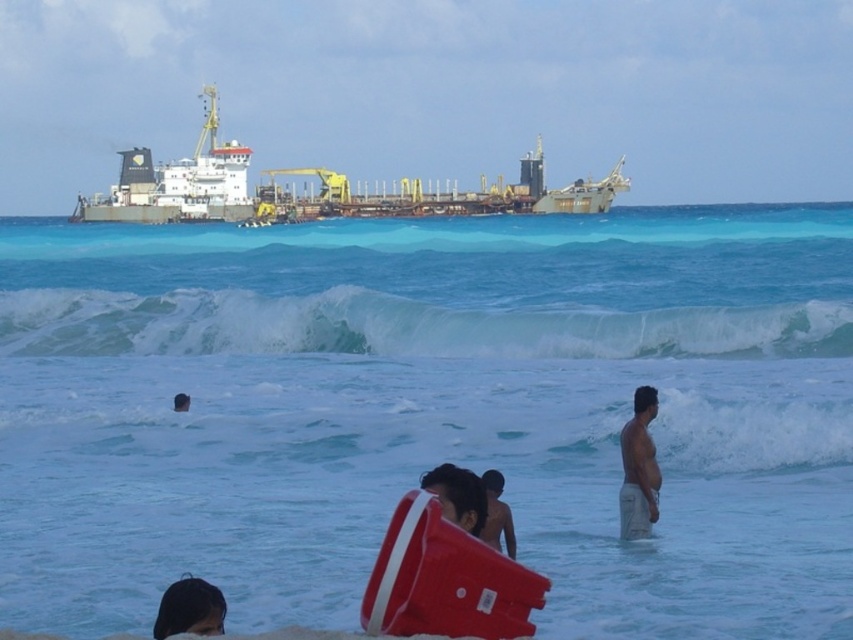
Question: Among these objects, which one is farthest from the camera?

Choices:
 (A) smooth skin person at center
 (B) dark brown hair at lower left
 (C) white frothy wave at upper center

Answer: (C)

Question: Estimate the real-world distances between objects in this image. Which object is farther from the white frothy wave at upper center?

Choices:
 (A) smooth skin person at center
 (B) dark brown hair at center
 (C) blue water at center
 (D) dark brown hair at lower left

Answer: (B)

Question: Does white frothy wave at upper center come in front of dark brown hair at lower left?

Choices:
 (A) no
 (B) yes

Answer: (A)

Question: In this image, where is white frothy wave at upper center located relative to skinny tan man at right?

Choices:
 (A) above
 (B) below

Answer: (A)

Question: Which of the following is the farthest from the observer?

Choices:
 (A) white frothy wave at upper center
 (B) smooth skin person at center
 (C) dark brown hair at lower center
 (D) dark brown hair at center

Answer: (A)

Question: Does white frothy wave at upper center appear under green metallic ship at upper center?

Choices:
 (A) yes
 (B) no

Answer: (A)